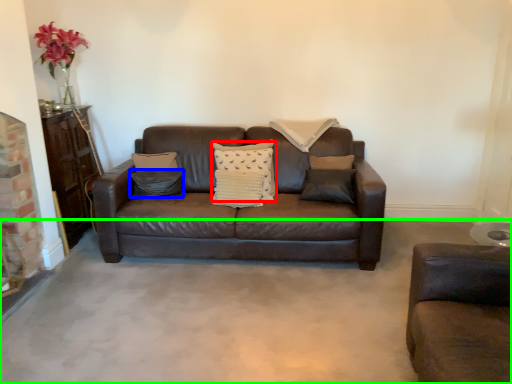
Question: Estimate the real-world distances between objects in this image. Which object is closer to pillow (highlighted by a red box), pillow (highlighted by a blue box) or concrete (highlighted by a green box)?

Choices:
 (A) pillow
 (B) concrete

Answer: (A)